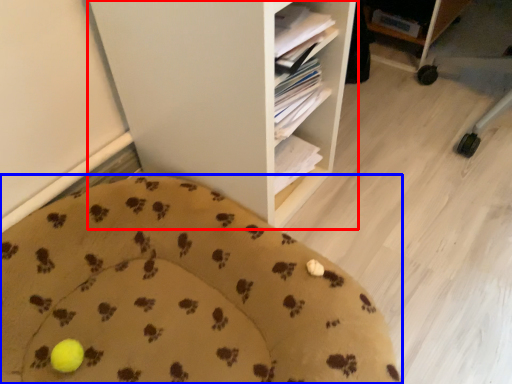
Question: Which of the following is the closest to the observer, shelf (highlighted by a red box) or furniture (highlighted by a blue box)?

Choices:
 (A) shelf
 (B) furniture

Answer: (B)